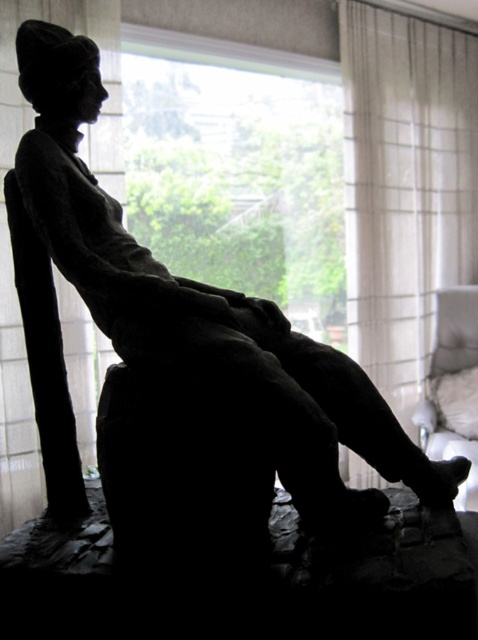
You are an interior designer assessing the lighting in a room with a seated figure sculpture. You notice the transparent glass window at upper center and the white sheer curtain at right. Which object is closer to you, the viewer?

The transparent glass window at upper center is closer to you because it is in front of the white sheer curtain at right.

From the picture: You are an interior designer assessing the lighting in the room. You notice the transparent glass window at upper center and the white sheer curtain at right. Which object is positioned to the left side of the other?

The transparent glass window at upper center is positioned to the left of the white sheer curtain at right.

You are standing in a room with a dark sculpture. There is a point at coordinates (239, 170). What object is located at this point?

The transparent glass window at upper center is located at point (239, 170).